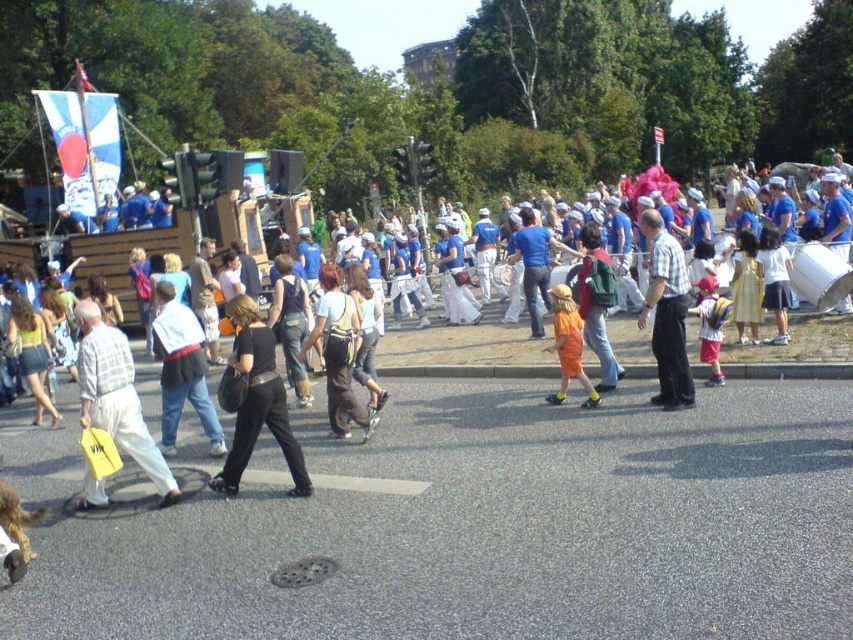
Can you confirm if black matte pants at center is taller than black leather pants at center?

No.

Is point (250, 320) positioned before point (329, 326)?

Yes, point (250, 320) is closer to viewer.

You are a GUI agent. You are given a task and a screenshot of the screen. Output one action in this format:
    pyautogui.click(x=<x>, y=<y>)
    Task: Click on the black matte pants at center
    This screenshot has width=853, height=640.
    Given the screenshot: What is the action you would take?
    pyautogui.click(x=257, y=401)

Identify the location of black matte pants at center. (257, 401).

Does black matte pants at center appear on the left side of orange cotton shirt at center?

Indeed, black matte pants at center is positioned on the left side of orange cotton shirt at center.

Does black matte pants at center lie in front of orange cotton shirt at center?

Yes, it is in front of orange cotton shirt at center.

Where is `black matte pants at center`? Image resolution: width=853 pixels, height=640 pixels. black matte pants at center is located at coordinates (257, 401).

Is black matte pants at center positioned before plaid shirt at center?

Yes, it is in front of plaid shirt at center.

Does black matte pants at center have a lesser height compared to plaid shirt at center?

Yes.

Is point (254, 342) farther from camera compared to point (685, 369)?

No.

Identify the location of black matte pants at center. This screenshot has width=853, height=640. (257, 401).